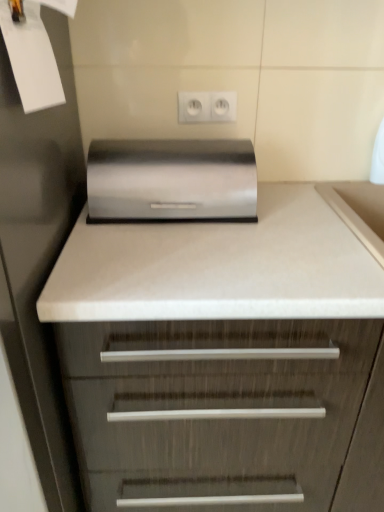
Question: Considering the relative sizes of satin metallic breadbox at center and white plastic electric outlet at upper center in the image provided, is satin metallic breadbox at center smaller than white plastic electric outlet at upper center?

Choices:
 (A) yes
 (B) no

Answer: (B)

Question: Is satin metallic breadbox at center further to the viewer compared to white plastic electric outlet at upper center?

Choices:
 (A) yes
 (B) no

Answer: (B)

Question: Is satin metallic breadbox at center looking in the opposite direction of white plastic electric outlet at upper center?

Choices:
 (A) no
 (B) yes

Answer: (A)

Question: Does satin metallic breadbox at center have a lesser height compared to white plastic electric outlet at upper center?

Choices:
 (A) no
 (B) yes

Answer: (A)

Question: Can white plastic electric outlet at upper center be found inside satin metallic breadbox at center?

Choices:
 (A) no
 (B) yes

Answer: (A)

Question: In the image, is satin wood chest of drawers at center positioned in front of or behind white plastic electric outlet at upper center?

Choices:
 (A) front
 (B) behind

Answer: (A)

Question: Looking at the image, does satin wood chest of drawers at center seem bigger or smaller compared to white plastic electric outlet at upper center?

Choices:
 (A) big
 (B) small

Answer: (A)

Question: Considering the positions of satin wood chest of drawers at center and white plastic electric outlet at upper center in the image, is satin wood chest of drawers at center wider or thinner than white plastic electric outlet at upper center?

Choices:
 (A) thin
 (B) wide

Answer: (B)

Question: Considering the positions of point (337, 297) and point (180, 96), is point (337, 297) closer or farther from the camera than point (180, 96)?

Choices:
 (A) farther
 (B) closer

Answer: (B)

Question: From a real-world perspective, relative to satin wood chest of drawers at center, is satin metallic breadbox at center vertically above or below?

Choices:
 (A) above
 (B) below

Answer: (A)

Question: Visually, is satin metallic breadbox at center positioned to the left or to the right of satin wood chest of drawers at center?

Choices:
 (A) right
 (B) left

Answer: (B)

Question: Relative to satin wood chest of drawers at center, is satin metallic breadbox at center in front or behind?

Choices:
 (A) front
 (B) behind

Answer: (B)

Question: Is satin metallic breadbox at center wider or thinner than satin wood chest of drawers at center?

Choices:
 (A) thin
 (B) wide

Answer: (A)

Question: Is point (21, 77) closer or farther from the camera than point (192, 117)?

Choices:
 (A) farther
 (B) closer

Answer: (B)

Question: From the image's perspective, is white paper at upper left positioned above or below white plastic electric outlet at upper center?

Choices:
 (A) below
 (B) above

Answer: (A)